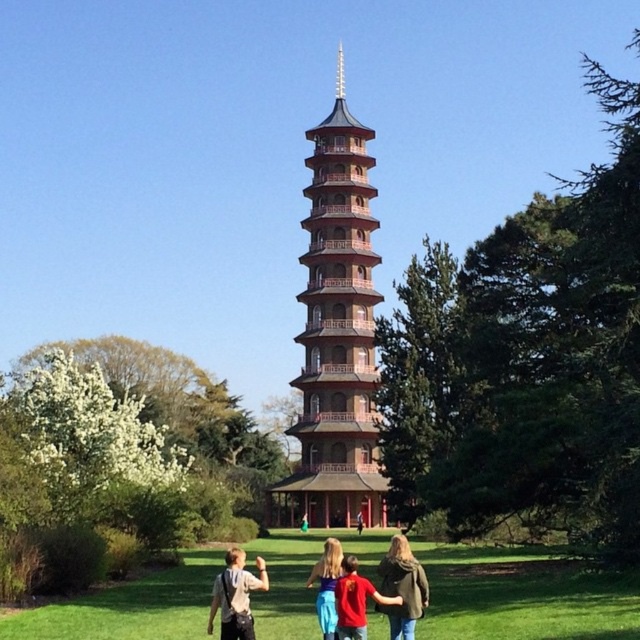
You are standing at the center of the image and want to place a new decorative stone exactly at the position where the denim jacket at lower center is located. What are the coordinates of that position?

The coordinates of the position where the denim jacket at lower center is located are at point [403,588].

You are standing in the scene and see the matte black backpack at lower center and the blue denim jeans at center. Which object is located more to the left?

The matte black backpack at lower center is more to the left than the blue denim jeans at center.

You are standing in front of the pagoda and want to take a photo of the two points mentioned. Which point, point (243, 625) or point (360, 515), is closer to you?

Point (243, 625) is closer to the camera than point (360, 515), so it is closer to you.